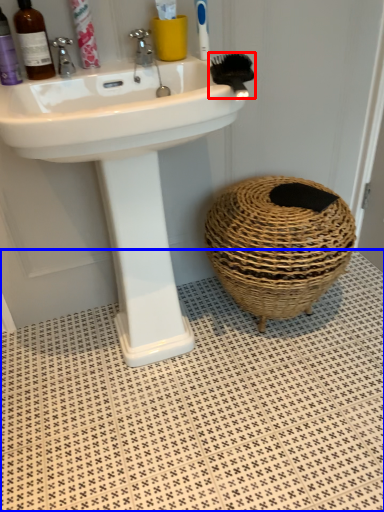
Question: Which of the following is the closest to the observer, brush (highlighted by a red box) or tile (highlighted by a blue box)?

Choices:
 (A) brush
 (B) tile

Answer: (B)